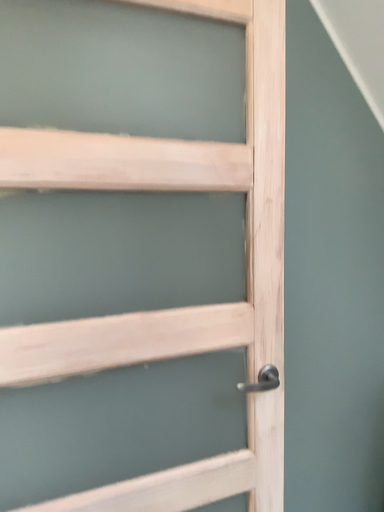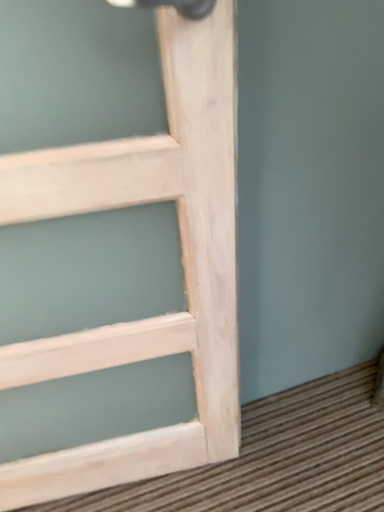
Question: Which way did the camera rotate in the video?

Choices:
 (A) rotated left
 (B) rotated right

Answer: (A)